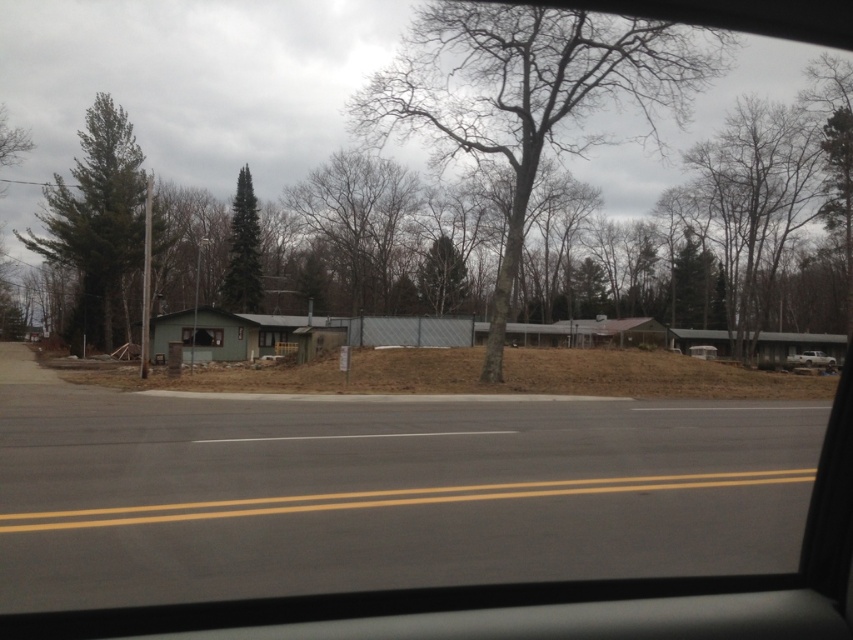
Is bare branches at upper right thinner than green textured pine tree at center?

No, bare branches at upper right is not thinner than green textured pine tree at center.

Does bare branches at upper right have a smaller size compared to green textured pine tree at center?

No, bare branches at upper right is not smaller than green textured pine tree at center.

This screenshot has width=853, height=640. In order to click on bare branches at upper right in this screenshot , I will do `click(751, 205)`.

Does green textured tree at left appear over white matte truck at right?

Yes, green textured tree at left is above white matte truck at right.

Which of these two, green textured tree at left or white matte truck at right, stands shorter?

white matte truck at right

Describe the element at coordinates (97, 225) in the screenshot. I see `green textured tree at left` at that location.

Where is `green textured tree at left`? green textured tree at left is located at coordinates (97, 225).

At what (x,y) coordinates should I click in order to perform the action: click on green matte tree at upper center. Please return your answer as a coordinate pair (x, y). Image resolution: width=853 pixels, height=640 pixels. Looking at the image, I should click on (442, 276).

At what (x,y) coordinates should I click in order to perform the action: click on green matte tree at upper center. Please return your answer as a coordinate pair (x, y). The height and width of the screenshot is (640, 853). Looking at the image, I should click on (442, 276).

Where is `green matte tree at upper center`? The height and width of the screenshot is (640, 853). green matte tree at upper center is located at coordinates (442, 276).